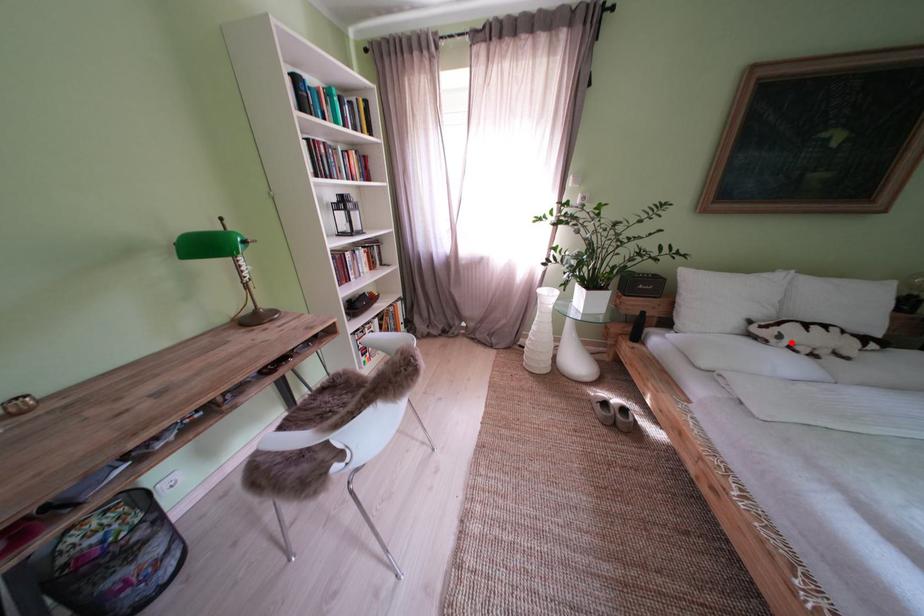
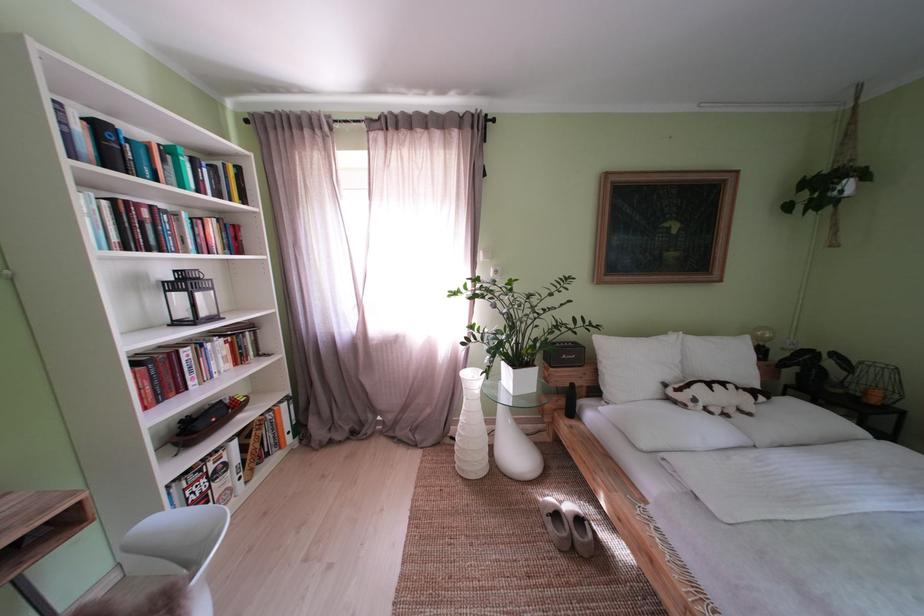
The point at the highlighted location is marked in the first image. Where is the corresponding point in the second image?

(706, 406)